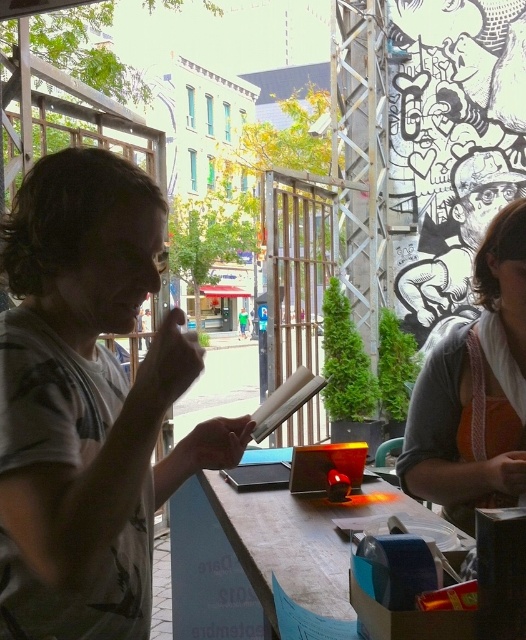
Is point (462, 481) positioned after point (326, 573)?

Yes, it is behind point (326, 573).

Measure the distance between orange fabric apron at right and wooden table at center.

12.34 inches

Is point (470, 410) farther from viewer compared to point (208, 611)?

No.

Find the location of a particular element. orange fabric apron at right is located at coordinates (476, 392).

From the picture: Is light brown t-shirt at left bigger than orange fabric apron at right?

Correct, light brown t-shirt at left is larger in size than orange fabric apron at right.

Find the location of `light brown t-shirt at left`. light brown t-shirt at left is located at coordinates (87, 401).

Between point (86, 435) and point (485, 387), which one is positioned in front?

Positioned in front is point (86, 435).

The width and height of the screenshot is (526, 640). I want to click on light brown t-shirt at left, so pyautogui.click(x=87, y=401).

Who is positioned more to the left, light brown t-shirt at left or wooden table at center?

light brown t-shirt at left is more to the left.

Is the position of light brown t-shirt at left less distant than that of wooden table at center?

Yes.

The image size is (526, 640). Describe the element at coordinates (87, 401) in the screenshot. I see `light brown t-shirt at left` at that location.

Where is `light brown t-shirt at left`? light brown t-shirt at left is located at coordinates (87, 401).